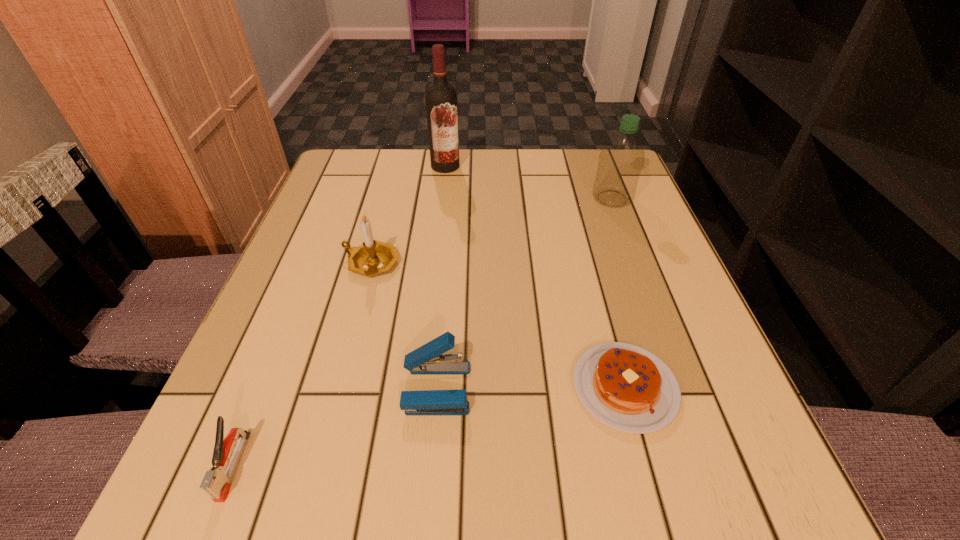
Image resolution: width=960 pixels, height=540 pixels. In order to click on free space between the tallest object and the water bottle in this screenshot , I will do `click(529, 183)`.

Where is `free area in between the third farthest object and the nearer stapler`? The width and height of the screenshot is (960, 540). free area in between the third farthest object and the nearer stapler is located at coordinates tap(302, 364).

In order to click on free point between the pancake and the left stapler in this screenshot , I will do [x=429, y=427].

In order to click on free area in between the second farthest object and the fourth shortest object in this screenshot , I will do `click(492, 231)`.

Image resolution: width=960 pixels, height=540 pixels. What are the coordinates of `free spot between the wine bottle and the pancake` in the screenshot? It's located at (535, 276).

You are a GUI agent. You are given a task and a screenshot of the screen. Output one action in this format:
    pyautogui.click(x=<x>, y=<y>)
    Task: Click on the vacant space in between the water bottle and the right stapler
    The image size is (960, 540).
    Given the screenshot: What is the action you would take?
    pyautogui.click(x=524, y=293)

At what (x,y) coordinates should I click in order to perform the action: click on unoccupied area between the fifth shortest object and the farther stapler. Please return your answer as a coordinate pair (x, y). The width and height of the screenshot is (960, 540). Looking at the image, I should click on (524, 293).

You are a GUI agent. You are given a task and a screenshot of the screen. Output one action in this format:
    pyautogui.click(x=<x>, y=<y>)
    Task: Click on the vacant space in between the fifth shortest object and the farther stapler
    This screenshot has height=540, width=960.
    Given the screenshot: What is the action you would take?
    pyautogui.click(x=524, y=293)

Find the location of `free area in between the leftmost object and the farther stapler`. free area in between the leftmost object and the farther stapler is located at coordinates (335, 427).

The image size is (960, 540). Find the location of `vacant area between the leftmost object and the pancake`. vacant area between the leftmost object and the pancake is located at coordinates (429, 427).